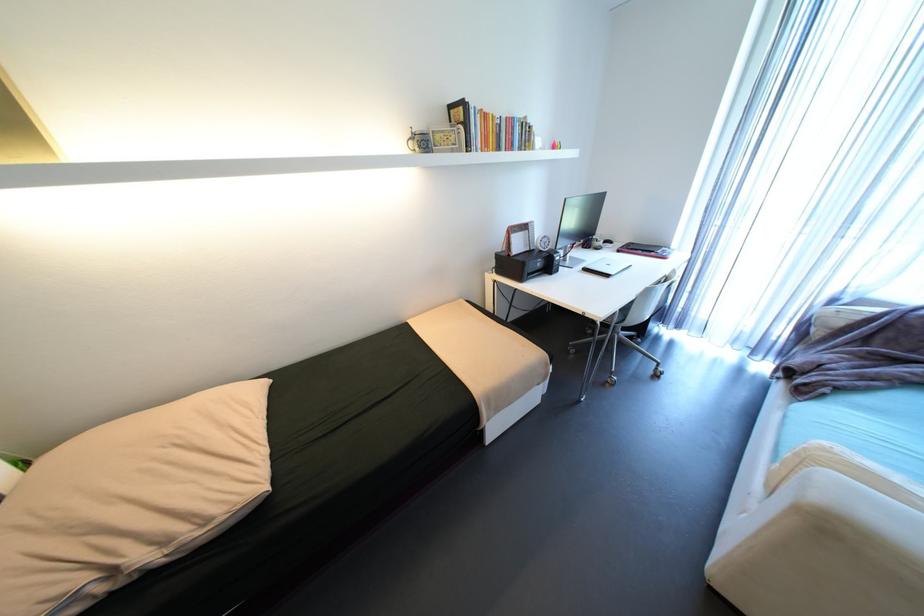
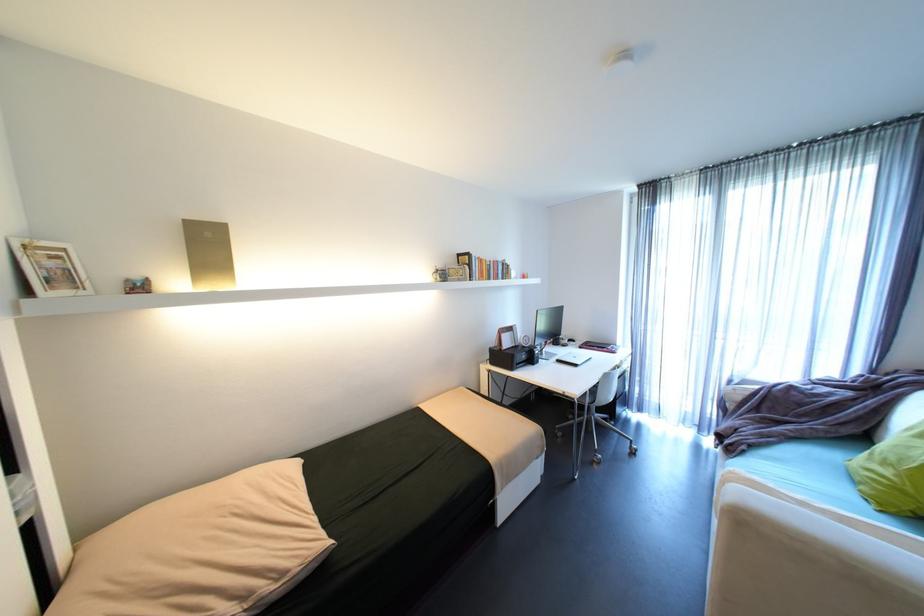
Find the pixel in the second image that matches point (214, 522) in the first image.

(289, 575)